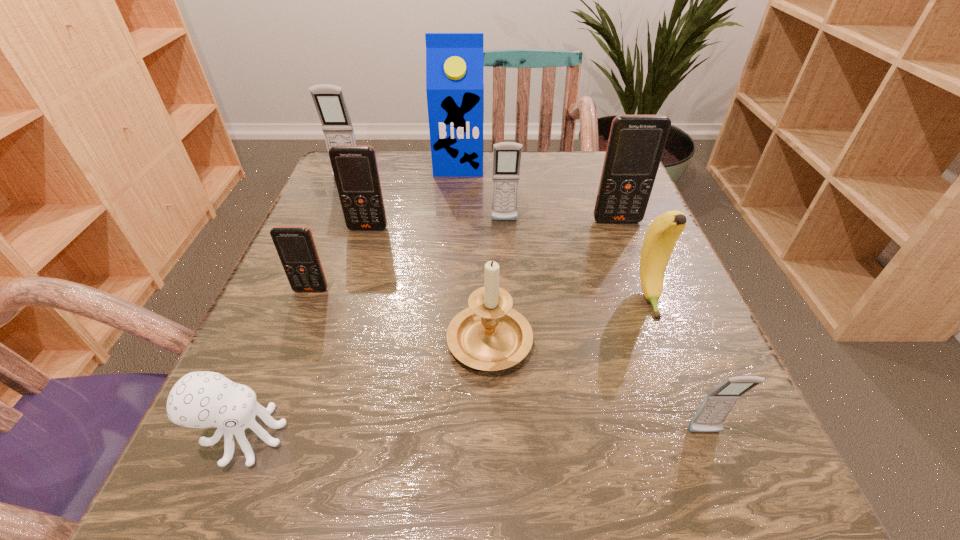
The width and height of the screenshot is (960, 540). I want to click on blank space located 0.270m on the front-facing side of the second gray cellular telephone from left to right, so click(x=512, y=325).

Locate an element on the screen. Image resolution: width=960 pixels, height=540 pixels. blank area located on the screen of the second nearest orange cellular telephone is located at coordinates (320, 386).

The height and width of the screenshot is (540, 960). I want to click on free location located 0.050m from the stem of the banana, so click(666, 344).

Image resolution: width=960 pixels, height=540 pixels. I want to click on vacant space situated with a handle on the side of the candle holder, so click(487, 209).

At what (x,y) coordinates should I click in order to perform the action: click on vacant position located 0.300m with a handle on the side of the candle holder. Please return your answer as a coordinate pair (x, y). Looking at the image, I should click on (487, 201).

Where is `vacant space located 0.080m with a handle on the side of the candle holder`? This screenshot has height=540, width=960. vacant space located 0.080m with a handle on the side of the candle holder is located at coordinates (488, 268).

Where is `free space located on the screen of the nearest orange cellular telephone`? free space located on the screen of the nearest orange cellular telephone is located at coordinates (281, 366).

The image size is (960, 540). I want to click on vacant space located 0.080m on the front-facing side of the white octopus, so click(x=347, y=436).

You are a GUI agent. You are given a task and a screenshot of the screen. Output one action in this format:
    pyautogui.click(x=<x>, y=<y>)
    Task: Click on the carton that is at the far edge
    The width and height of the screenshot is (960, 540).
    Given the screenshot: What is the action you would take?
    pyautogui.click(x=454, y=61)

Identify the location of cellular telephone positioned at the far edge. The width and height of the screenshot is (960, 540). (329, 100).